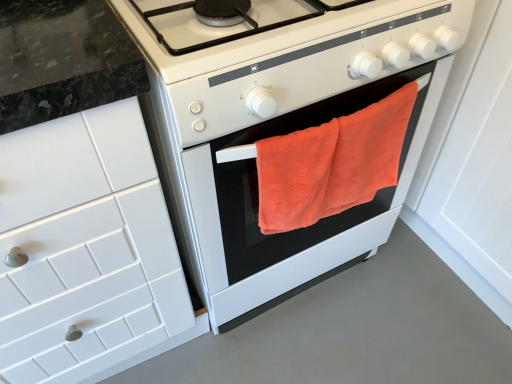
Question: From the image's perspective, is orange towel at center beneath white tile cabinet at left?

Choices:
 (A) yes
 (B) no

Answer: (B)

Question: Is orange towel at center closer to camera compared to white tile cabinet at left?

Choices:
 (A) yes
 (B) no

Answer: (B)

Question: Considering the relative positions of orange towel at center and white tile cabinet at left in the image provided, is orange towel at center to the right of white tile cabinet at left from the viewer's perspective?

Choices:
 (A) no
 (B) yes

Answer: (B)

Question: Is orange towel at center taller than white tile cabinet at left?

Choices:
 (A) no
 (B) yes

Answer: (A)

Question: Does orange towel at center have a lesser width compared to white tile cabinet at left?

Choices:
 (A) no
 (B) yes

Answer: (A)

Question: Would you say orange towel at center is outside white tile cabinet at left?

Choices:
 (A) no
 (B) yes

Answer: (B)

Question: Is orange terry cloth towel at center with white tile cabinet at left?

Choices:
 (A) no
 (B) yes

Answer: (A)

Question: Is orange terry cloth towel at center at the left side of white tile cabinet at left?

Choices:
 (A) no
 (B) yes

Answer: (A)

Question: Can we say orange terry cloth towel at center lies outside white tile cabinet at left?

Choices:
 (A) no
 (B) yes

Answer: (B)

Question: Does orange terry cloth towel at center have a smaller size compared to white tile cabinet at left?

Choices:
 (A) yes
 (B) no

Answer: (A)

Question: Could white tile cabinet at left be considered to be inside orange terry cloth towel at center?

Choices:
 (A) no
 (B) yes

Answer: (A)

Question: Considering the relative sizes of orange terry cloth towel at center and white tile cabinet at left in the image provided, is orange terry cloth towel at center taller than white tile cabinet at left?

Choices:
 (A) yes
 (B) no

Answer: (B)

Question: Would you say white tile cabinet at left is a long distance from orange towel at center?

Choices:
 (A) no
 (B) yes

Answer: (A)